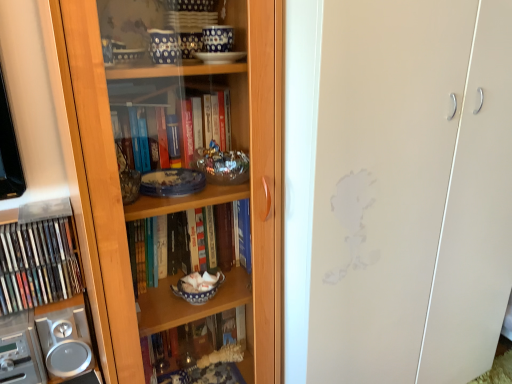
The width and height of the screenshot is (512, 384). Find the location of `blank space situated above silver metallic speaker at lower left (from a real-world perspective)`. blank space situated above silver metallic speaker at lower left (from a real-world perspective) is located at coordinates tap(39, 312).